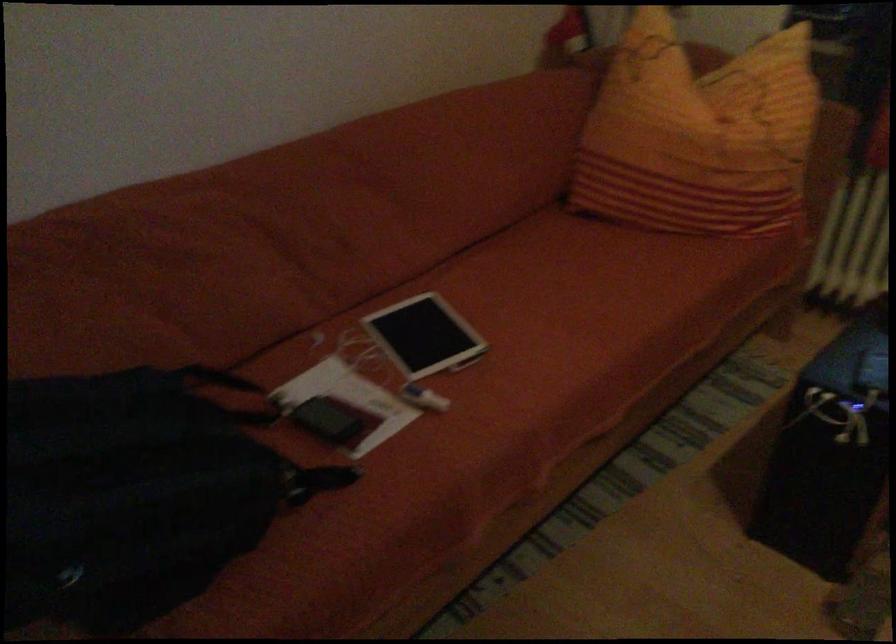
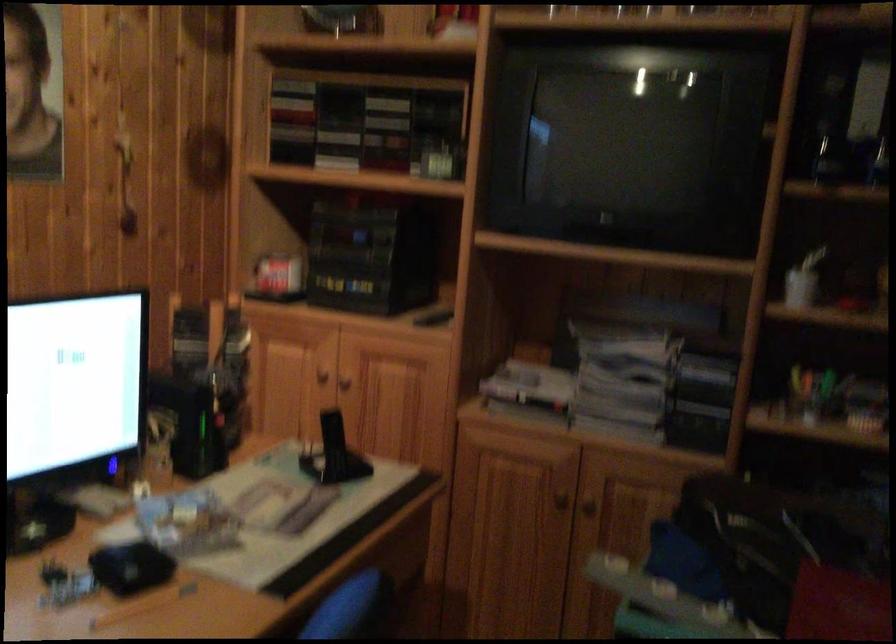
How did the camera likely rotate?

The camera's rotation is toward right-down.